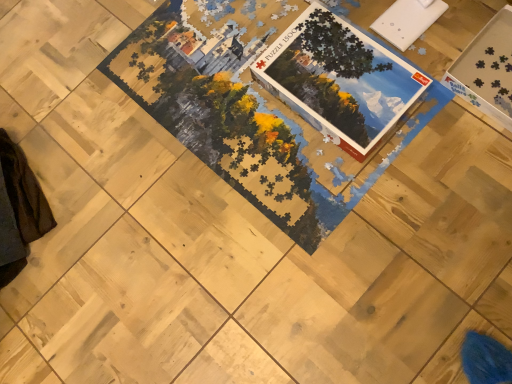
Where is `blank area to the left of matte cardboard puzzle box at center`? Image resolution: width=512 pixels, height=384 pixels. blank area to the left of matte cardboard puzzle box at center is located at coordinates (240, 121).